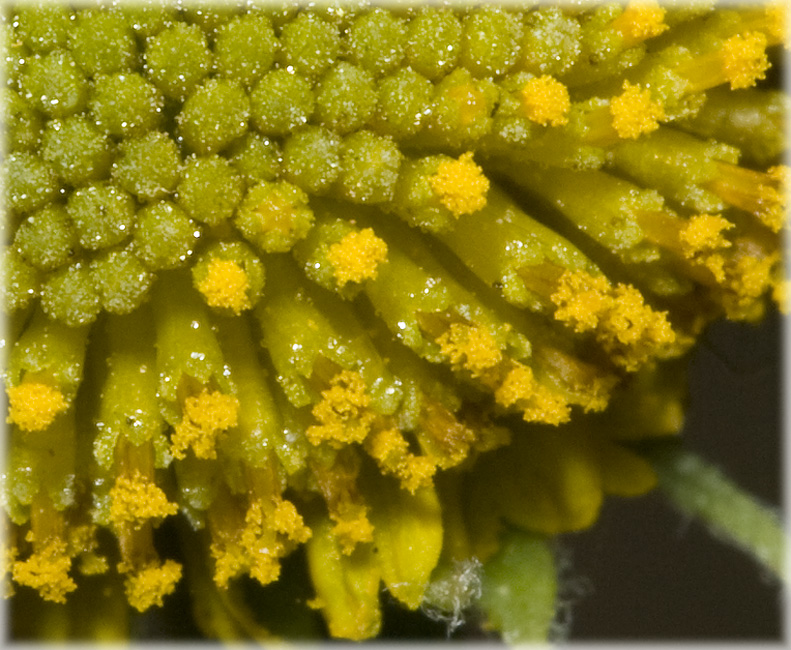
I want to click on green round plant, so click(x=214, y=186), click(x=165, y=227), click(x=112, y=281), click(x=107, y=216), click(x=137, y=170), click(x=195, y=136).